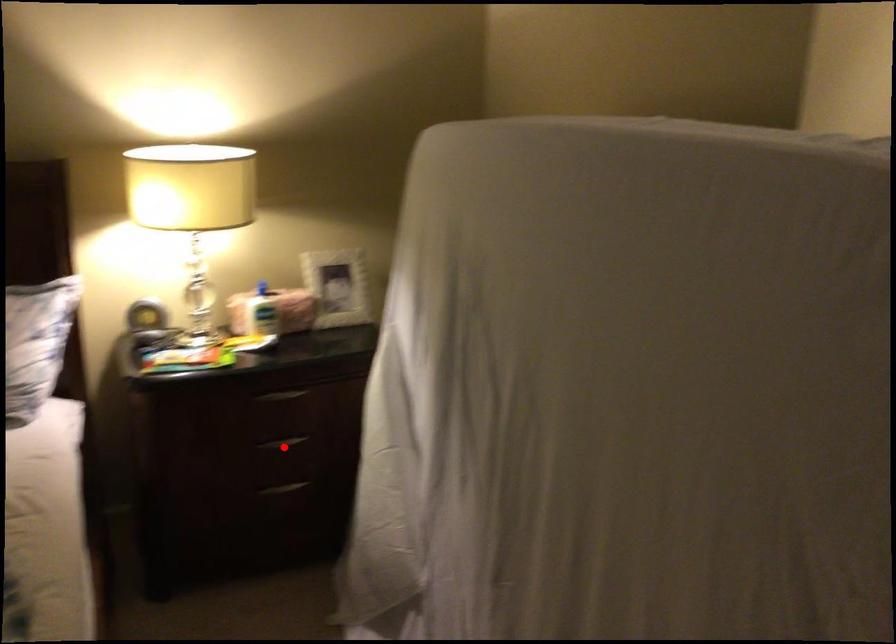
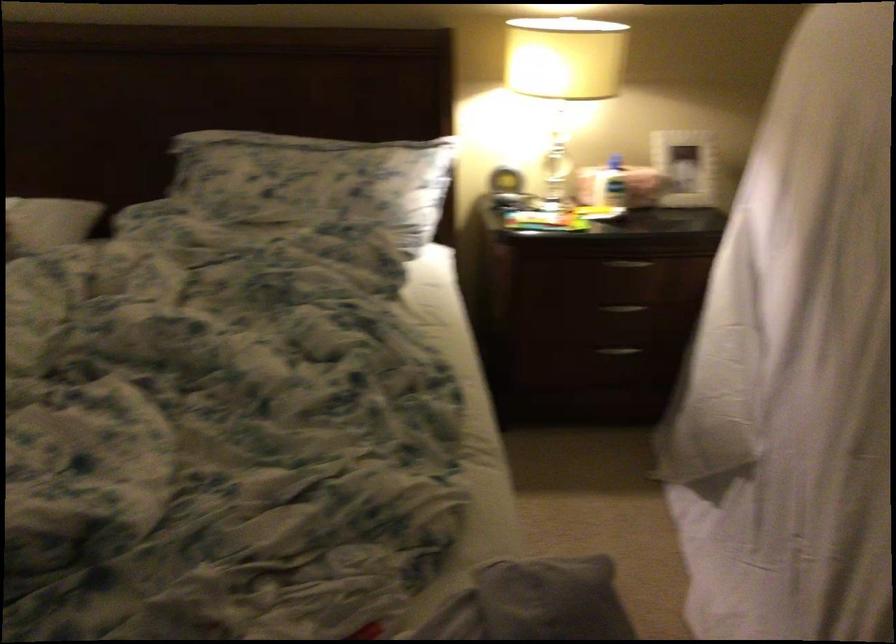
Locate, in the second image, the point that corresponds to the highlighted location in the first image.

(624, 308)